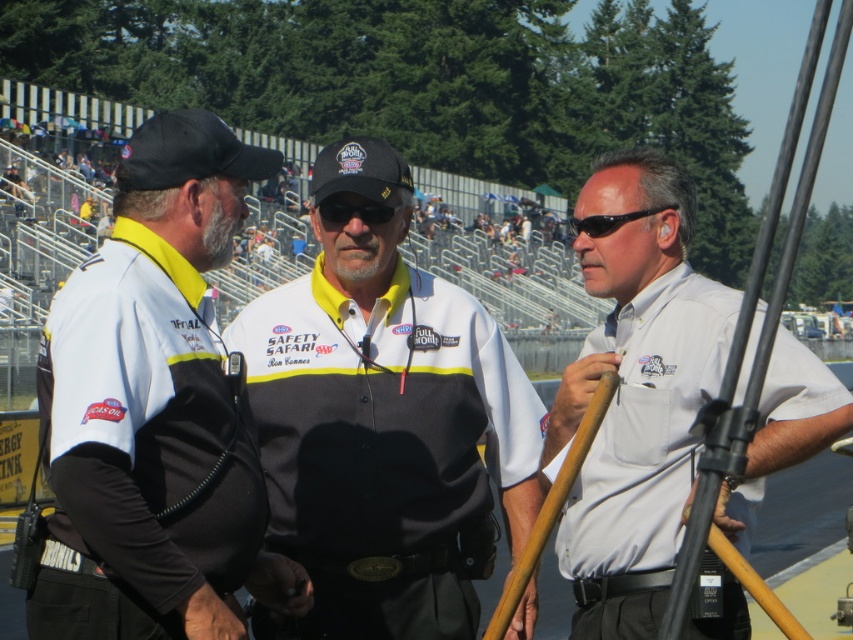
Question: Is the position of white fabric shirt at center less distant than that of white matte shirt at center?

Choices:
 (A) no
 (B) yes

Answer: (A)

Question: Which of these objects is positioned closest to the white fabric shirt at center?

Choices:
 (A) black matte sunglasses at center
 (B) white matte shirt at center
 (C) black uniform at center

Answer: (A)

Question: In this image, where is white fabric shirt at center located relative to black matte sunglasses at center?

Choices:
 (A) left
 (B) right

Answer: (B)

Question: Which point appears closest to the camera in this image?

Choices:
 (A) (383, 216)
 (B) (454, 388)
 (C) (184, 116)

Answer: (C)

Question: Which of the following is the closest to the observer?

Choices:
 (A) (97, 618)
 (B) (375, 220)

Answer: (A)

Question: In this image, where is white matte shirt at center located relative to black plastic sunglasses at center?

Choices:
 (A) above
 (B) below

Answer: (B)